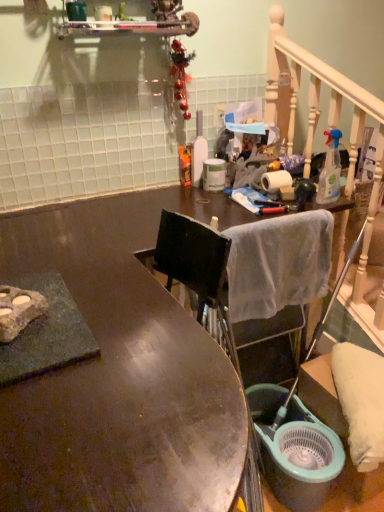
Question: Is white soft towel at center situated inside white matte toilet paper at upper right or outside?

Choices:
 (A) outside
 (B) inside

Answer: (A)

Question: Looking at the image, does white soft towel at center seem bigger or smaller compared to white matte toilet paper at upper right?

Choices:
 (A) big
 (B) small

Answer: (A)

Question: Estimate the real-world distances between objects in this image. Which object is closer to the teal plastic bucket at lower right?

Choices:
 (A) white matte toilet paper at upper right
 (B) shiny brown desk at center
 (C) white soft towel at center
 (D) clear plastic spray bottle at upper right, marked as the 2th bottle in a left-to-right arrangement
 (E) white glossy bottle at center, marked as the second bottle in a right-to-left arrangement

Answer: (C)

Question: Based on their relative distances, which object is farther from the shiny brown desk at center?

Choices:
 (A) white matte toilet paper at upper right
 (B) clear plastic spray bottle at upper right, positioned as the 1th bottle in front-to-back order
 (C) white soft towel at center
 (D) white glossy bottle at center, the second bottle when ordered from front to back
 (E) teal plastic bucket at lower right

Answer: (B)